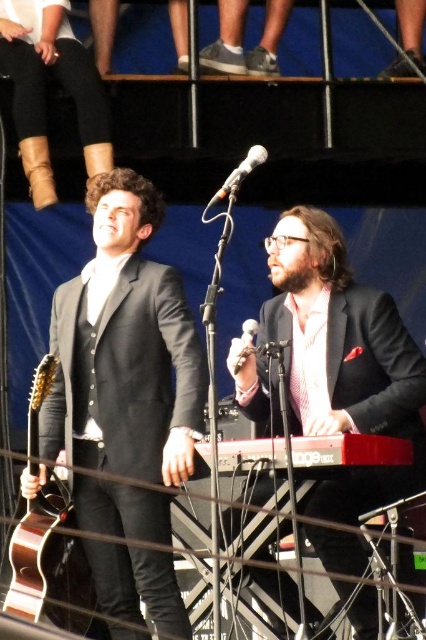
Question: Is matte black suit at left thinner than silver metallic microphone at center?

Choices:
 (A) no
 (B) yes

Answer: (A)

Question: Estimate the real-world distances between objects in this image. Which object is closer to the wooden acoustic guitar at left?

Choices:
 (A) silver metallic microphone at center
 (B) matte black suit at left

Answer: (B)

Question: Which point is closer to the camera?

Choices:
 (A) silver metallic microphone at center
 (B) metallic keyboard at center
 (C) matte black suit at left
 (D) metallic silver microphone at center

Answer: (B)

Question: Which object is closer to the camera taking this photo?

Choices:
 (A) wooden acoustic guitar at left
 (B) matte black suit at center

Answer: (B)

Question: Can you confirm if wooden acoustic guitar at left is smaller than metallic keyboard at center?

Choices:
 (A) yes
 (B) no

Answer: (A)

Question: Can you confirm if matte black suit at center is positioned to the left of wooden acoustic guitar at left?

Choices:
 (A) no
 (B) yes

Answer: (A)